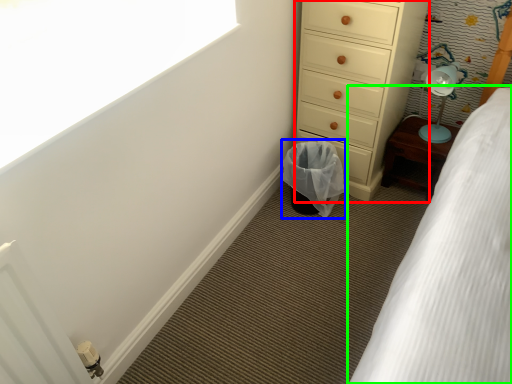
Question: Based on their relative distances, which object is nearer to chest of drawers (highlighted by a red box)? Choose from laundry basket (highlighted by a blue box) and bed (highlighted by a green box).

Choices:
 (A) laundry basket
 (B) bed

Answer: (A)